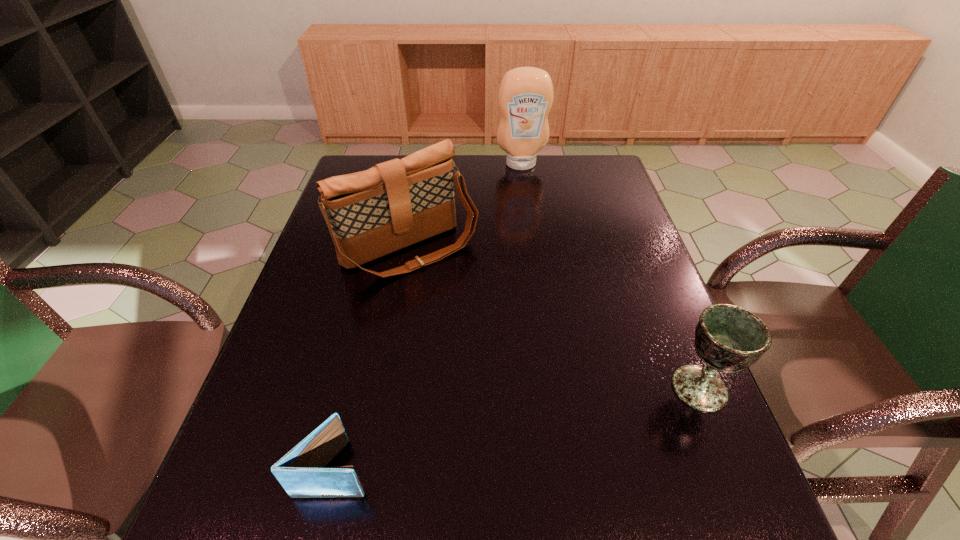
This screenshot has height=540, width=960. In order to click on free space that satisfies the following two spatial constraints: 1. on the front side of the tallest object; 2. on the left side of the second shortest object in this screenshot , I will do `click(550, 388)`.